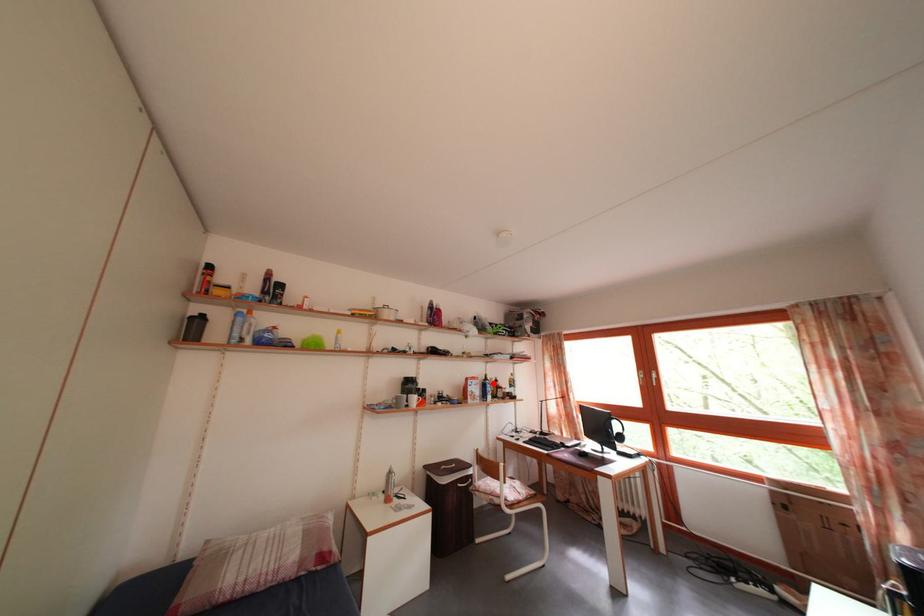
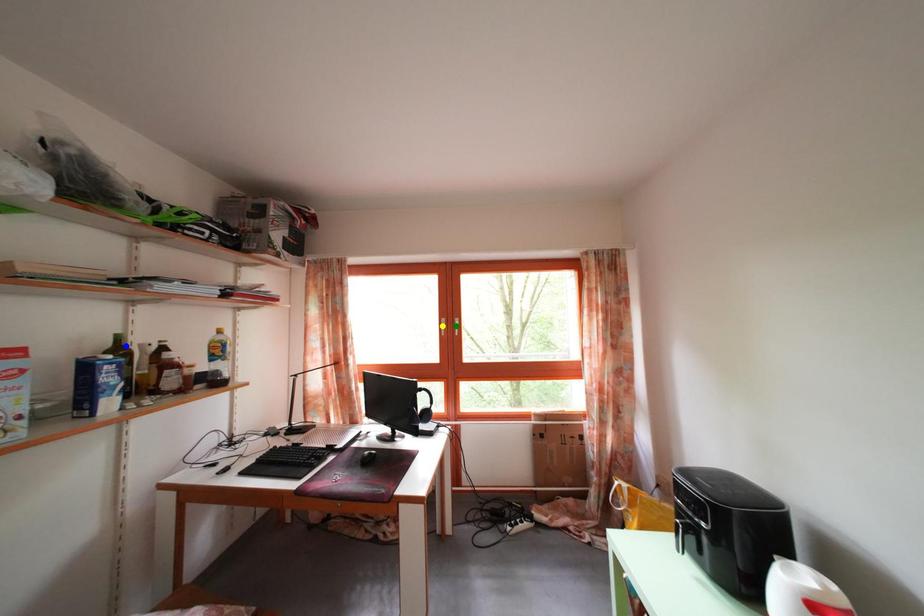
Question: I am providing you with two images of the same scene from different viewpoints. A red point is marked on the first image. You are given multiple points on the second image. In image 2, which mark is for the same physical point as the one in image 1?

Choices:
 (A) yellow point
 (B) blue point
 (C) green point

Answer: (B)